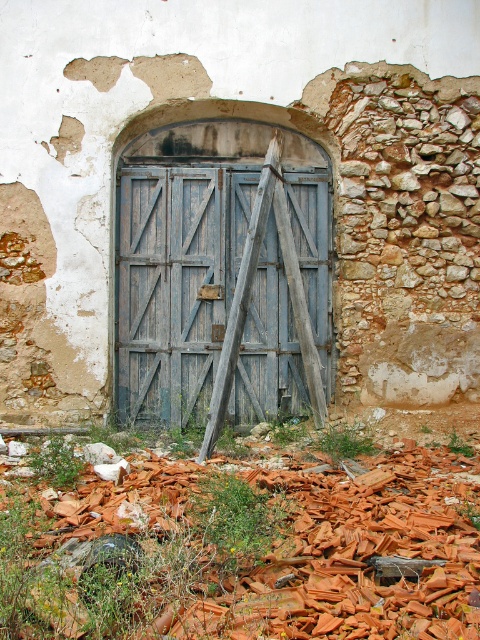
You are standing in front of the arched doorway and notice two points marked on the wall. The first point is at coordinates point (472,560) and the second is at point (248,310). Which point is nearer to your current position?

Point (472,560) is closer to the camera than point (248,310), so the first point is nearer to your current position.

You are standing in front of an old building with an arched doorway. You see an orange clay tiles at center and a blue wooden door at center. Which object is located to the right of the other?

The orange clay tiles at center is positioned on the right side of blue wooden door at center, so the orange clay tiles at center is to the right of the blue wooden door at center.

You are a painter standing in front of the old structure. You need to paint the orange clay tiles at center and the blue wooden door at center. Which object should you paint first if you want to start from the lower part of the structure?

You should paint the orange clay tiles at center first because it is positioned under the blue wooden door at center, making it the lower part of the structure.